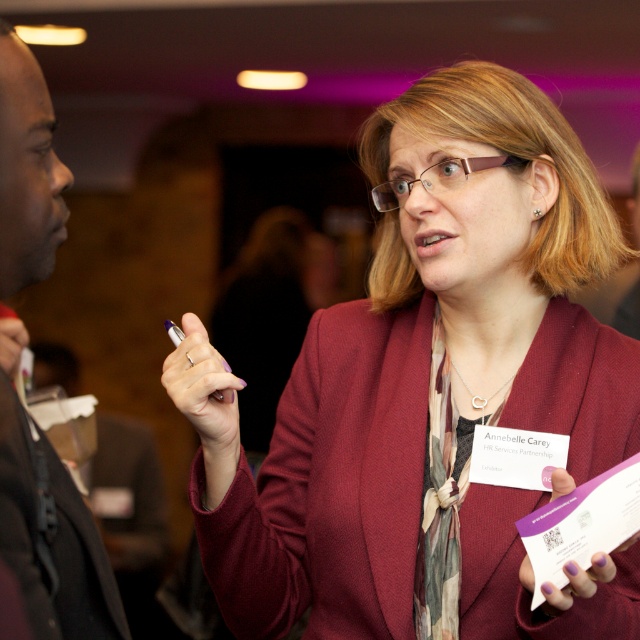
You are organizing a presentation and need to know which object is bigger between the black fabric suit at left and the purple matte card at center. Can you tell me which one is larger?

The black fabric suit at left has a larger size compared to the purple matte card at center, so the black fabric suit at left is larger.

You are at a networking event and see the maroon fabric coat at center and the purple matte card at center. Which object is positioned to the left from your perspective?

The maroon fabric coat at center is positioned to the left of the purple matte card at center.